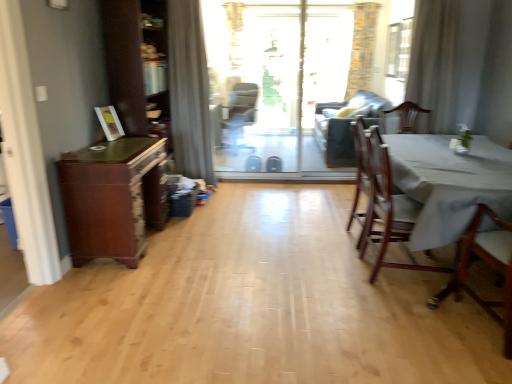
Question: Is gray fabric curtain at upper center, positioned as the first curtain in left-to-right order, spatially inside wooden chair at right, the 2th chair from the front, or outside of it?

Choices:
 (A) outside
 (B) inside

Answer: (A)

Question: Does point (180, 56) appear closer or farther from the camera than point (411, 221)?

Choices:
 (A) closer
 (B) farther

Answer: (B)

Question: Which object is positioned closest to the light brown wooden chair at lower right, the third chair when ordered from back to front?

Choices:
 (A) brown wood dresser at left
 (B) gray fabric curtain at upper center, acting as the 2th curtain starting from the right
 (C) wooden chair at right, the second chair when ordered from back to front
 (D) white sheer curtain at upper right, which ranks as the 1th curtain in right-to-left order
 (E) dark gray fabric couch at center

Answer: (C)

Question: Estimate the real-world distances between objects in this image. Which object is closer to the transparent glass screen door at center?

Choices:
 (A) matte gray armchair at center
 (B) brown wood dresser at left
 (C) white cloth-covered table at right
 (D) transparent glass window screen at upper right
 (E) light brown wooden chair at lower right, the first chair in the front-to-back sequence

Answer: (A)